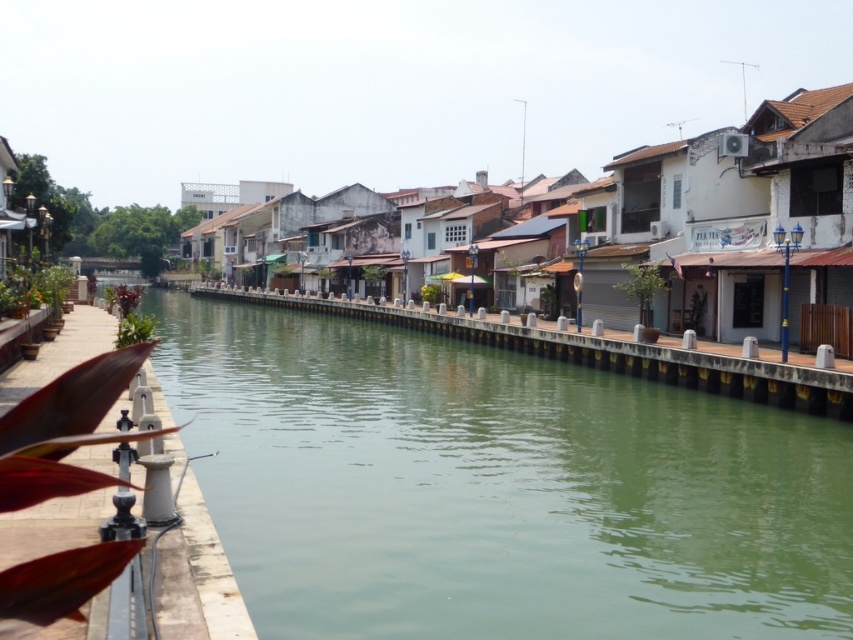
You are a boat captain navigating a vessel that is 20 meters long. You need to pass between the white concrete dock at lower left and the smooth concrete railing at center. Can your boat fit through the space between them?

The distance between the white concrete dock at lower left and the smooth concrete railing at center is 23.23 meters. Since your boat is 20 meters long, it can fit through the space as there is enough clearance.

You are a boat captain navigating a small boat through the canal. Your boat has a height of 1.2 meters. The green smooth water at center is where you need to pass through. Considering the smooth concrete railing at center, will your boat be able to pass under it without hitting the railing?

The green smooth water at center has a greater height compared to the smooth concrete railing at center. This means the vertical clearance under the railing is sufficient for the boat with a height of 1.2 meters to pass safely.